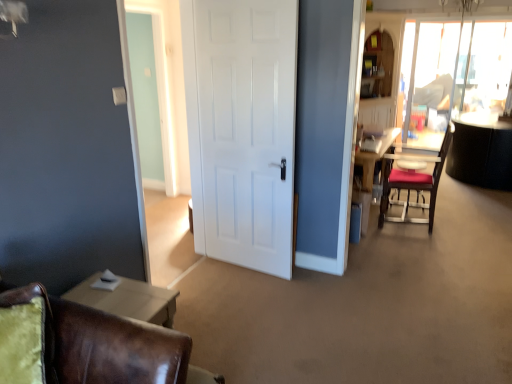
This screenshot has width=512, height=384. Find the location of `blank space situated above brown leather chair at lower left, arranged as the second chair when viewed from the right (from a real-world perspective)`. blank space situated above brown leather chair at lower left, arranged as the second chair when viewed from the right (from a real-world perspective) is located at coordinates (119, 300).